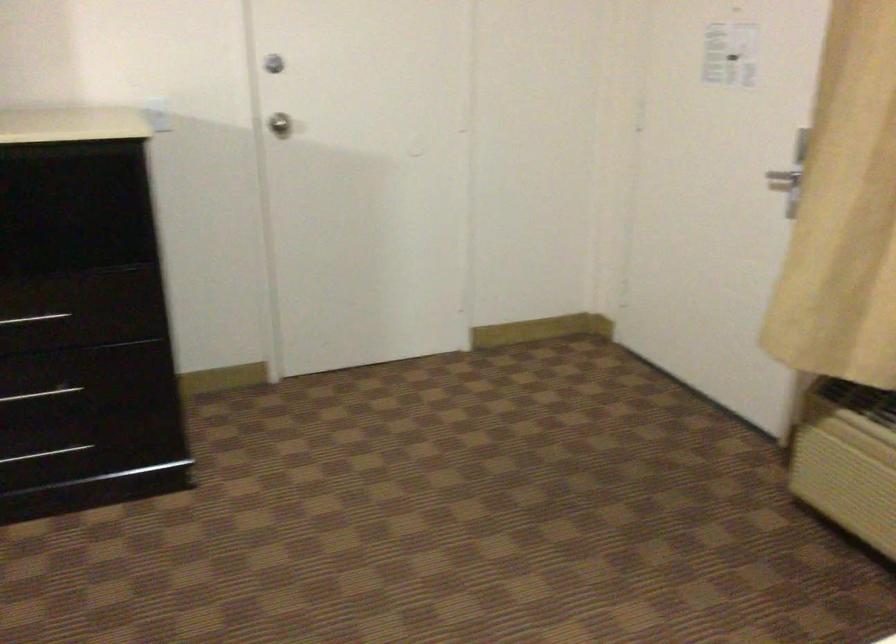
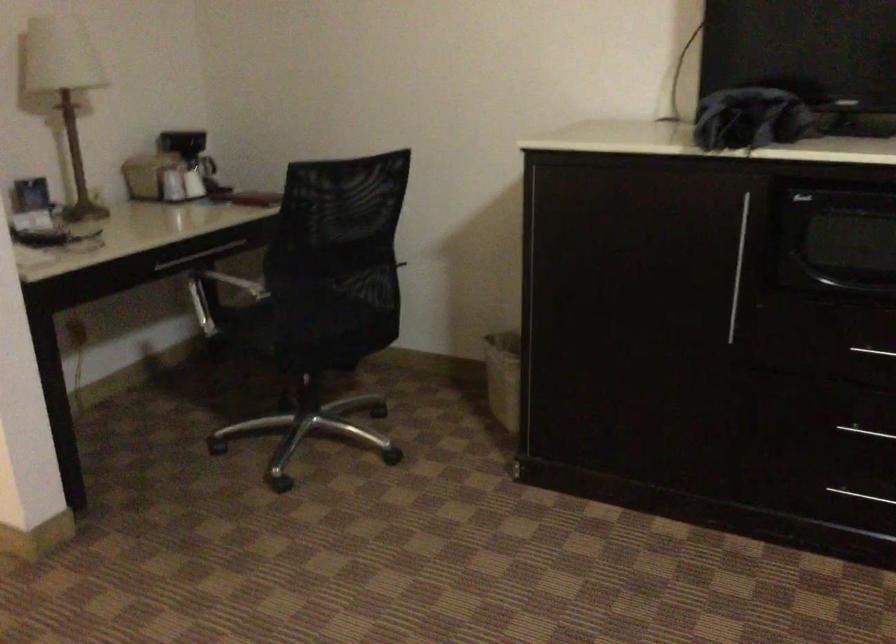
Question: The camera is either moving clockwise (left) or counter-clockwise (right) around the object. The first image is from the beginning of the video and the second image is from the end. Is the camera moving left or right when shooting the video?

Choices:
 (A) Left
 (B) Right

Answer: (B)